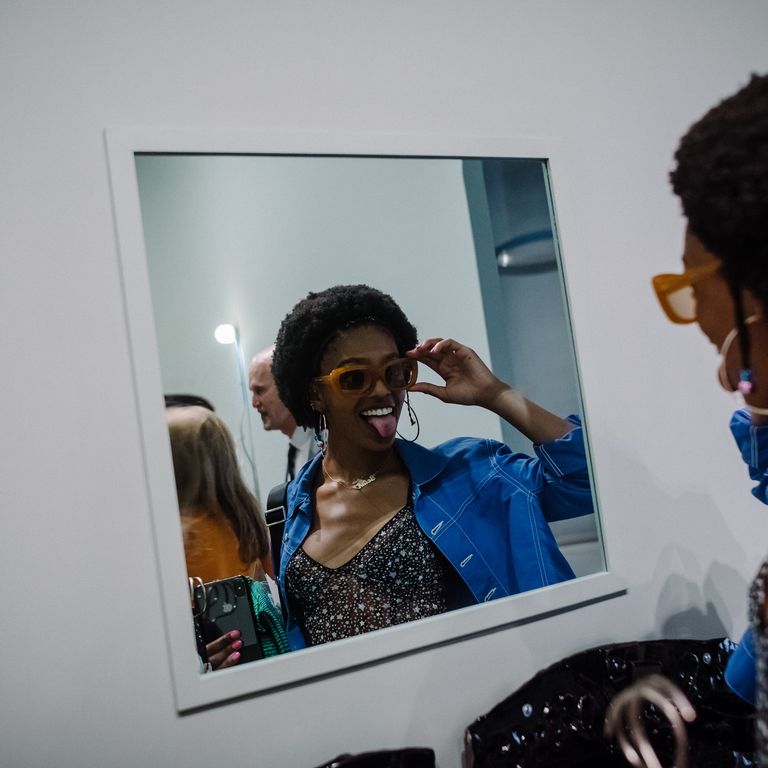
Identify the location of light bulb. (223, 338).